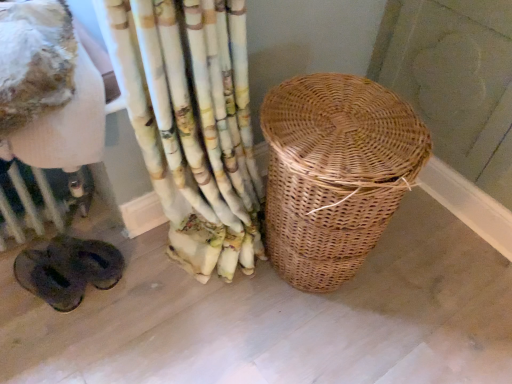
Question: From a real-world perspective, is woven brown basket at center positioned above or below white painted radiator at lower left?

Choices:
 (A) above
 (B) below

Answer: (A)

Question: From the image's perspective, is woven brown basket at center located above or below white painted radiator at lower left?

Choices:
 (A) above
 (B) below

Answer: (A)

Question: Considering the positions of woven brown basket at center and white painted radiator at lower left in the image, is woven brown basket at center taller or shorter than white painted radiator at lower left?

Choices:
 (A) tall
 (B) short

Answer: (A)

Question: In terms of size, does white painted radiator at lower left appear bigger or smaller than woven brown basket at center?

Choices:
 (A) big
 (B) small

Answer: (B)

Question: From a real-world perspective, is white painted radiator at lower left positioned above or below woven brown basket at center?

Choices:
 (A) below
 (B) above

Answer: (A)

Question: In terms of height, does white painted radiator at lower left look taller or shorter compared to woven brown basket at center?

Choices:
 (A) tall
 (B) short

Answer: (B)

Question: Is white painted radiator at lower left wider or thinner than woven brown basket at center?

Choices:
 (A) wide
 (B) thin

Answer: (B)